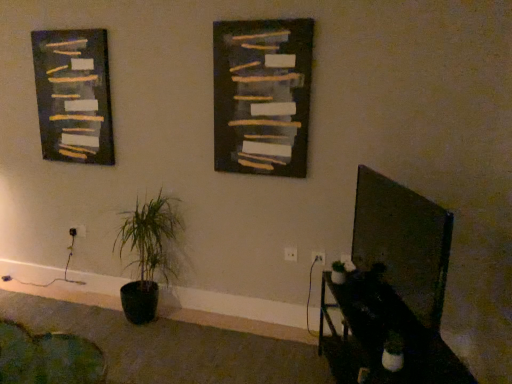
Where is `green fabric swivel chair at lower left`? green fabric swivel chair at lower left is located at coordinates (48, 357).

Consider the image. How much space does white plastic electric outlet at lower center, the 1th electric outlet when ordered from right to left, occupy horizontally?

white plastic electric outlet at lower center, the 1th electric outlet when ordered from right to left, is 0.55 inches wide.

What is the approximate height of white plastic electric outlet at lower center, arranged as the first electric outlet when viewed from the front?

9.09 centimeters.

The height and width of the screenshot is (384, 512). Describe the element at coordinates (78, 231) in the screenshot. I see `white plastic electric outlet at lower left, the 3th electric outlet viewed from the front` at that location.

The height and width of the screenshot is (384, 512). I want to click on white plastic electric outlet at center, marked as the 2th electric outlet in a right-to-left arrangement, so click(290, 254).

Locate an element on the screen. The height and width of the screenshot is (384, 512). green fabric swivel chair at lower left is located at coordinates (48, 357).

From the image's perspective, is white plastic electric outlet at center, the 2th electric outlet viewed from the front, located above green matte plant at lower left?

Result: No.

Can you confirm if white plastic electric outlet at center, which is the second electric outlet from back to front, is bigger than green matte plant at lower left?

Actually, white plastic electric outlet at center, which is the second electric outlet from back to front, might be smaller than green matte plant at lower left.

Which is more to the right, white plastic electric outlet at center, which is counted as the 2th electric outlet, starting from the left, or green matte plant at lower left?

From the viewer's perspective, white plastic electric outlet at center, which is counted as the 2th electric outlet, starting from the left, appears more on the right side.

Does white plastic electric outlet at center, the 2th electric outlet viewed from the front, have a greater width compared to green matte plant at lower left?

No, white plastic electric outlet at center, the 2th electric outlet viewed from the front, is not wider than green matte plant at lower left.

Is point (319, 259) positioned behind point (84, 229)?

No, it is in front of (84, 229).

From a real-world perspective, which electric outlet is the 2nd one underneath the white plastic electric outlet at lower center, the third electric outlet from the back? Please provide its 2D coordinates.

[(78, 231)]

Can you confirm if white plastic electric outlet at lower center, the 1th electric outlet when ordered from right to left, is smaller than white plastic electric outlet at lower left, placed as the 1th electric outlet when sorted from back to front?

Indeed, white plastic electric outlet at lower center, the 1th electric outlet when ordered from right to left, has a smaller size compared to white plastic electric outlet at lower left, placed as the 1th electric outlet when sorted from back to front.

Between white plastic electric outlet at lower center, arranged as the first electric outlet when viewed from the front, and white plastic electric outlet at lower left, which is counted as the third electric outlet, starting from the right, which one appears on the right side from the viewer's perspective?

From the viewer's perspective, white plastic electric outlet at lower center, arranged as the first electric outlet when viewed from the front, appears more on the right side.

Considering the sizes of objects white plastic electric outlet at lower left, placed as the 1th electric outlet when sorted from back to front, and dark gray textured painting at left in the image provided, who is shorter, white plastic electric outlet at lower left, placed as the 1th electric outlet when sorted from back to front, or dark gray textured painting at left?

With less height is white plastic electric outlet at lower left, placed as the 1th electric outlet when sorted from back to front.

Does point (72, 229) appear closer or farther from the camera than point (93, 135)?

Point (72, 229).

Can we say white plastic electric outlet at lower left, placed as the 1th electric outlet when sorted from back to front, lies outside dark gray textured painting at left?

white plastic electric outlet at lower left, placed as the 1th electric outlet when sorted from back to front, lies outside dark gray textured painting at left's area.

Does white plastic electric outlet at lower left, the 3th electric outlet viewed from the front, touch dark gray textured painting at left?

There is a gap between white plastic electric outlet at lower left, the 3th electric outlet viewed from the front, and dark gray textured painting at left.

From a real-world perspective, is dark matte board at center physically located above or below white plastic electric outlet at center, which is counted as the 2th electric outlet, starting from the left?

In terms of real-world spatial position, dark matte board at center is above white plastic electric outlet at center, which is counted as the 2th electric outlet, starting from the left.

Is dark matte board at center looking in the opposite direction of white plastic electric outlet at center, marked as the 2th electric outlet in a right-to-left arrangement?

No.

Considering the relative sizes of dark matte board at center and white plastic electric outlet at center, marked as the 2th electric outlet in a right-to-left arrangement, in the image provided, is dark matte board at center taller than white plastic electric outlet at center, marked as the 2th electric outlet in a right-to-left arrangement,?

Yes.

Is dark matte board at center surrounding white plastic electric outlet at center, which is counted as the 2th electric outlet, starting from the left?

That's incorrect, white plastic electric outlet at center, which is counted as the 2th electric outlet, starting from the left, is not inside dark matte board at center.

Is white plastic electric outlet at center, marked as the 2th electric outlet in a right-to-left arrangement, placed right next to dark matte board at center?

No, white plastic electric outlet at center, marked as the 2th electric outlet in a right-to-left arrangement, is not touching dark matte board at center.

In the scene shown: From a real-world perspective, is white plastic electric outlet at center, which is counted as the 2th electric outlet, starting from the left, positioned under dark matte board at center based on gravity?

Yes, from a real-world perspective, white plastic electric outlet at center, which is counted as the 2th electric outlet, starting from the left, is under dark matte board at center.

From the image's perspective, is white plastic electric outlet at center, which is the second electric outlet from back to front, above or below dark matte board at center?

white plastic electric outlet at center, which is the second electric outlet from back to front, is situated lower than dark matte board at center in the image.

From the image's perspective, is dark gray textured painting at left located above or below dark matte board at center?

Based on their image positions, dark gray textured painting at left is located above dark matte board at center.

Does dark gray textured painting at left turn towards dark matte board at center?

No.

Is dark gray textured painting at left not near dark matte board at center?

→ dark gray textured painting at left is positioned a significant distance from dark matte board at center.

Considering the sizes of green matte plant at lower left and white plastic electric outlet at lower center, the 1th electric outlet when ordered from right to left, in the image, is green matte plant at lower left bigger or smaller than white plastic electric outlet at lower center, the 1th electric outlet when ordered from right to left,?

Considering their sizes, green matte plant at lower left takes up more space than white plastic electric outlet at lower center, the 1th electric outlet when ordered from right to left.

Starting from the green matte plant at lower left, which electric outlet is the 1st one behind? Please provide its 2D coordinates.

[(318, 257)]

Is green matte plant at lower left positioned with its back to white plastic electric outlet at lower center, arranged as the first electric outlet when viewed from the front?

No, white plastic electric outlet at lower center, arranged as the first electric outlet when viewed from the front, is not at the back of green matte plant at lower left.

From a real-world perspective, is green matte plant at lower left physically below white plastic electric outlet at lower center, the third electric outlet from the back?

Yes, from a real-world perspective, green matte plant at lower left is beneath white plastic electric outlet at lower center, the third electric outlet from the back.

Where is `houseplant beneath the white plastic electric outlet at center, the 2th electric outlet viewed from the front (from a real-world perspective)`? houseplant beneath the white plastic electric outlet at center, the 2th electric outlet viewed from the front (from a real-world perspective) is located at coordinates (148, 253).

You are a GUI agent. You are given a task and a screenshot of the screen. Output one action in this format:
    pyautogui.click(x=<x>, y=<y>)
    Task: Click on the 2nd electric outlet behind when counting from the white plastic electric outlet at lower center, which is the third electric outlet from left to right
    
    Given the screenshot: What is the action you would take?
    pyautogui.click(x=78, y=231)

From the image, which object appears to be farther from white plastic electric outlet at center, which is the second electric outlet from back to front, white plastic electric outlet at lower left, the 3th electric outlet viewed from the front, or dark matte board at center?

Among the two, white plastic electric outlet at lower left, the 3th electric outlet viewed from the front, is located further to white plastic electric outlet at center, which is the second electric outlet from back to front.

Which object lies nearer to the anchor point dark gray textured painting at left, green matte plant at lower left or white plastic electric outlet at center, the 2th electric outlet viewed from the front?

Among the two, green matte plant at lower left is located nearer to dark gray textured painting at left.

Which object lies nearer to the anchor point white plastic electric outlet at lower center, the third electric outlet from the back, green fabric swivel chair at lower left or white plastic electric outlet at center, which is the second electric outlet from back to front?

white plastic electric outlet at center, which is the second electric outlet from back to front, lies closer to white plastic electric outlet at lower center, the third electric outlet from the back, than the other object.

Which object lies nearer to the anchor point green matte plant at lower left, black glossy table at lower right or white plastic electric outlet at center, the 2th electric outlet viewed from the front?

white plastic electric outlet at center, the 2th electric outlet viewed from the front, is closer to green matte plant at lower left.

Based on the photo, estimate the real-world distances between objects in this image. Which object is further from green matte plant at lower left, white plastic electric outlet at lower center, arranged as the first electric outlet when viewed from the front, or white plastic electric outlet at center, which is counted as the 2th electric outlet, starting from the left?

white plastic electric outlet at lower center, arranged as the first electric outlet when viewed from the front, is positioned further to the anchor green matte plant at lower left.

Which object lies nearer to the anchor point dark matte board at center, green matte plant at lower left or green fabric swivel chair at lower left?

Among the two, green matte plant at lower left is located nearer to dark matte board at center.

Considering their positions, is white plastic electric outlet at lower left, the 3th electric outlet viewed from the front, positioned further to white plastic electric outlet at lower center, the third electric outlet from the back, than white plastic electric outlet at center, marked as the 2th electric outlet in a right-to-left arrangement?

white plastic electric outlet at lower left, the 3th electric outlet viewed from the front, is positioned further to the anchor white plastic electric outlet at lower center, the third electric outlet from the back.

When comparing their distances from white plastic electric outlet at lower center, arranged as the first electric outlet when viewed from the front, does white plastic electric outlet at lower left, which is counted as the third electric outlet, starting from the right, or green fabric swivel chair at lower left seem closer?

Among the two, green fabric swivel chair at lower left is located nearer to white plastic electric outlet at lower center, arranged as the first electric outlet when viewed from the front.

Where is `houseplant between white plastic electric outlet at lower left, which is counted as the third electric outlet, starting from the right, and dark matte board at center`? Image resolution: width=512 pixels, height=384 pixels. houseplant between white plastic electric outlet at lower left, which is counted as the third electric outlet, starting from the right, and dark matte board at center is located at coordinates (148, 253).

Identify the location of houseplant that lies between dark gray textured painting at left and green fabric swivel chair at lower left from top to bottom. The image size is (512, 384). click(x=148, y=253).

Where is `bulletin board located between green fabric swivel chair at lower left and white plastic electric outlet at lower left, the first electric outlet viewed from the left, in the depth direction`? bulletin board located between green fabric swivel chair at lower left and white plastic electric outlet at lower left, the first electric outlet viewed from the left, in the depth direction is located at coordinates (262, 96).

Where is `bulletin board between dark gray textured painting at left and green fabric swivel chair at lower left in the vertical direction`? The width and height of the screenshot is (512, 384). bulletin board between dark gray textured painting at left and green fabric swivel chair at lower left in the vertical direction is located at coordinates (262, 96).